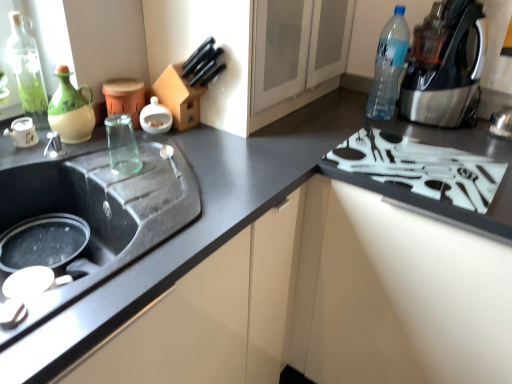
Where is `vacant space that is in between green matte teapot at left and transparent glass cup at sink`? vacant space that is in between green matte teapot at left and transparent glass cup at sink is located at coordinates 105,153.